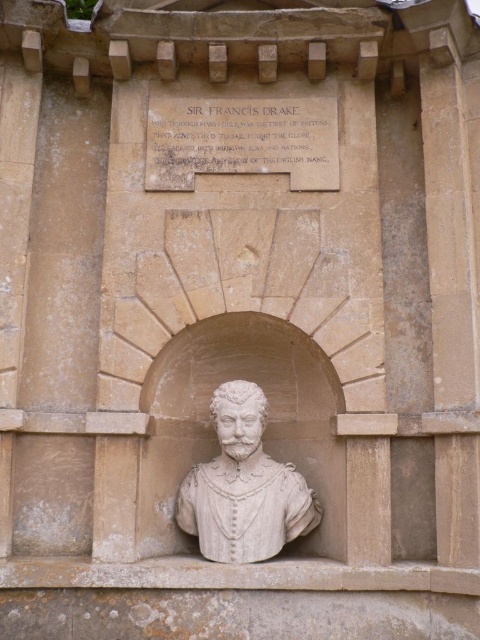
Question: Which of the following is the farthest from the observer?

Choices:
 (A) (192, 497)
 (B) (266, 134)

Answer: (B)

Question: Among these points, which one is nearest to the camera?

Choices:
 (A) (309, 506)
 (B) (311, 129)

Answer: (A)

Question: Is matte stone plaque at upper center bigger than white stone bust at center?

Choices:
 (A) yes
 (B) no

Answer: (B)

Question: Does matte stone plaque at upper center appear under white stone bust at center?

Choices:
 (A) yes
 (B) no

Answer: (B)

Question: Can you confirm if matte stone plaque at upper center is positioned to the left of white stone bust at center?

Choices:
 (A) no
 (B) yes

Answer: (B)